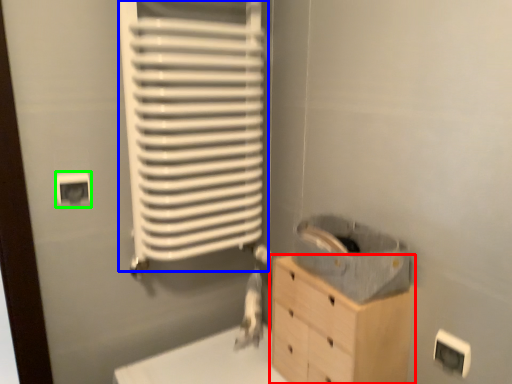
Question: Estimate the real-world distances between objects in this image. Which object is closer to chest of drawers (highlighted by a red box), radiator (highlighted by a blue box) or electric outlet (highlighted by a green box)?

Choices:
 (A) radiator
 (B) electric outlet

Answer: (A)